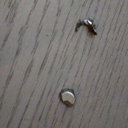
Where is `flat wood surface`? This screenshot has width=128, height=128. flat wood surface is located at coordinates (11, 51), (22, 57), (46, 68), (56, 71), (93, 84).